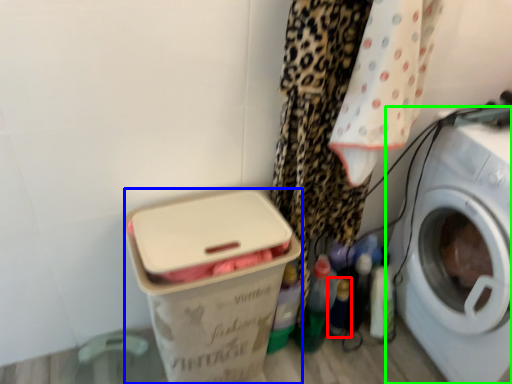
Question: Which is farther away from bottle (highlighted by a red box)? box (highlighted by a blue box) or washing machine (highlighted by a green box)?

Choices:
 (A) box
 (B) washing machine

Answer: (A)